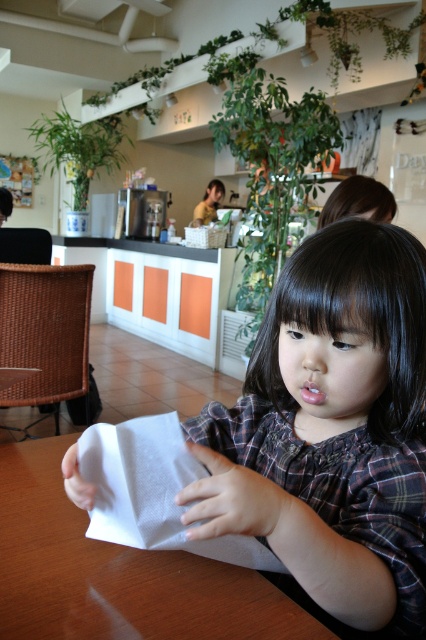
The width and height of the screenshot is (426, 640). What do you see at coordinates (331, 429) in the screenshot?
I see `white paper napkin at center` at bounding box center [331, 429].

Describe the element at coordinates (331, 429) in the screenshot. I see `white paper napkin at center` at that location.

The width and height of the screenshot is (426, 640). Find the location of `white paper napkin at center`. white paper napkin at center is located at coordinates (331, 429).